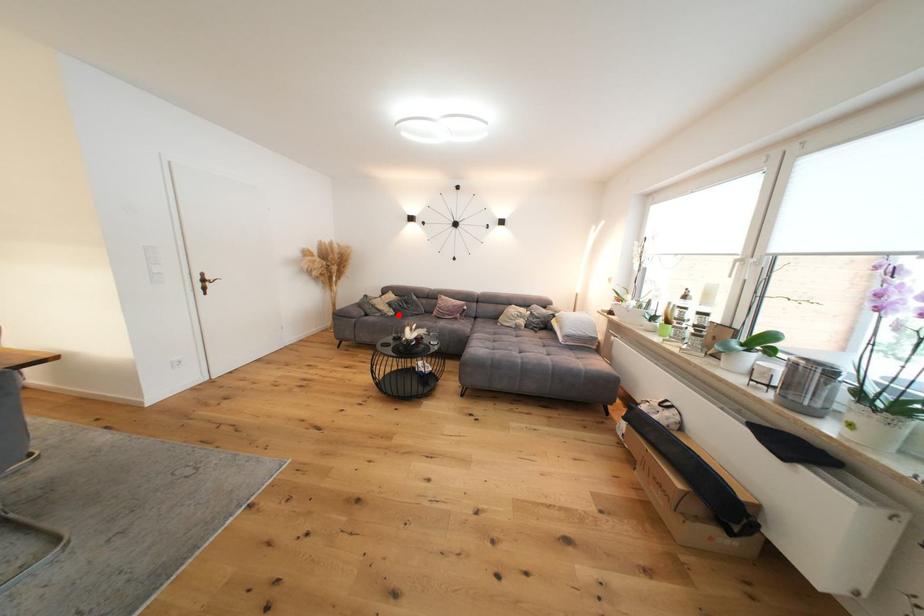
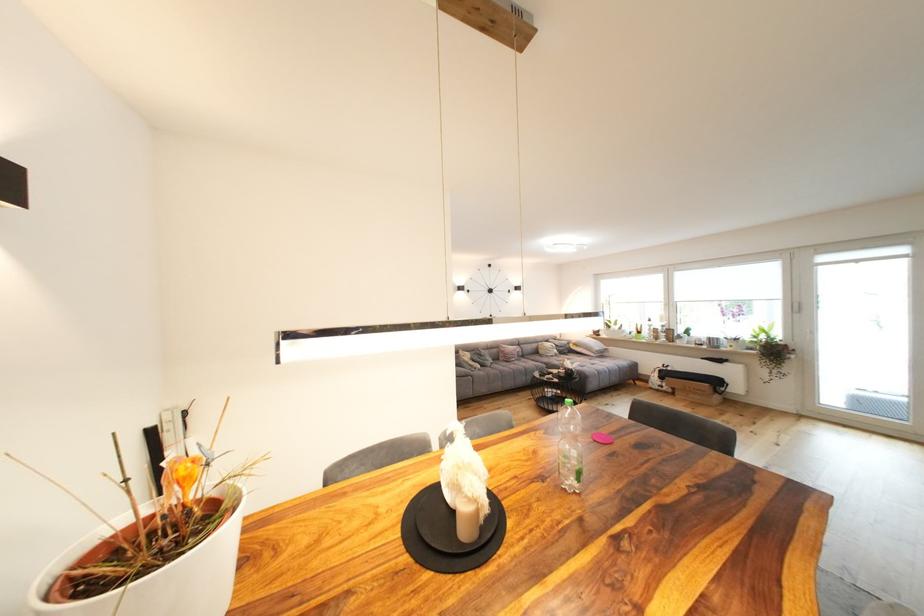
Question: I am providing you with two images of the same scene from different viewpoints. Image1 has a red point marked. In image2, the corresponding 3D location appears at what relative position? Reply with the corresponding letter.

Choices:
 (A) Closer
 (B) Farther

Answer: (B)